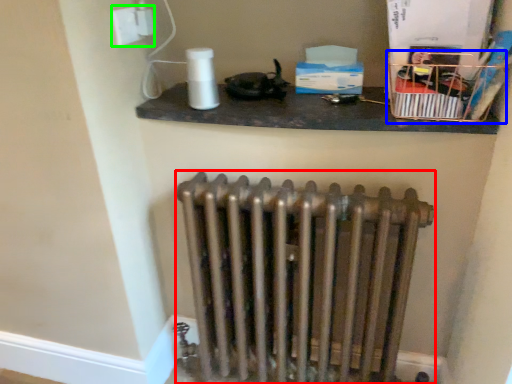
Question: Which object is positioned closest to radiator (highlighted by a red box)? Select from crate (highlighted by a blue box) and electric outlet (highlighted by a green box).

Choices:
 (A) crate
 (B) electric outlet

Answer: (A)